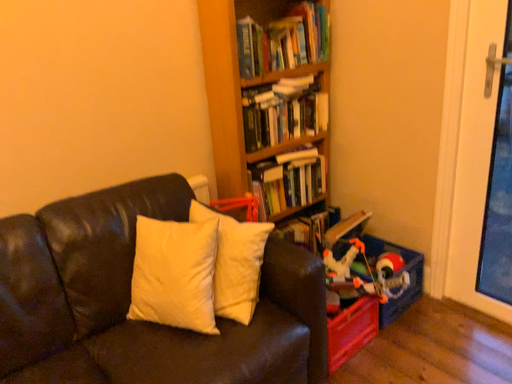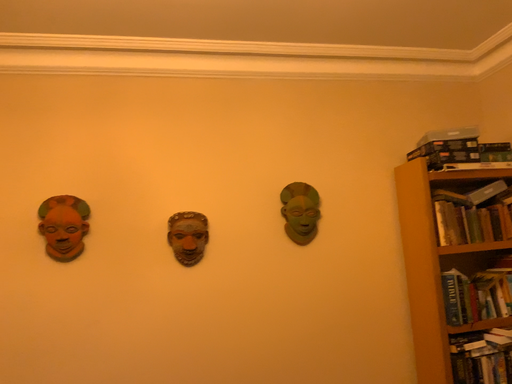
Question: How did the camera likely rotate when shooting the video?

Choices:
 (A) rotated downward
 (B) rotated upward

Answer: (B)